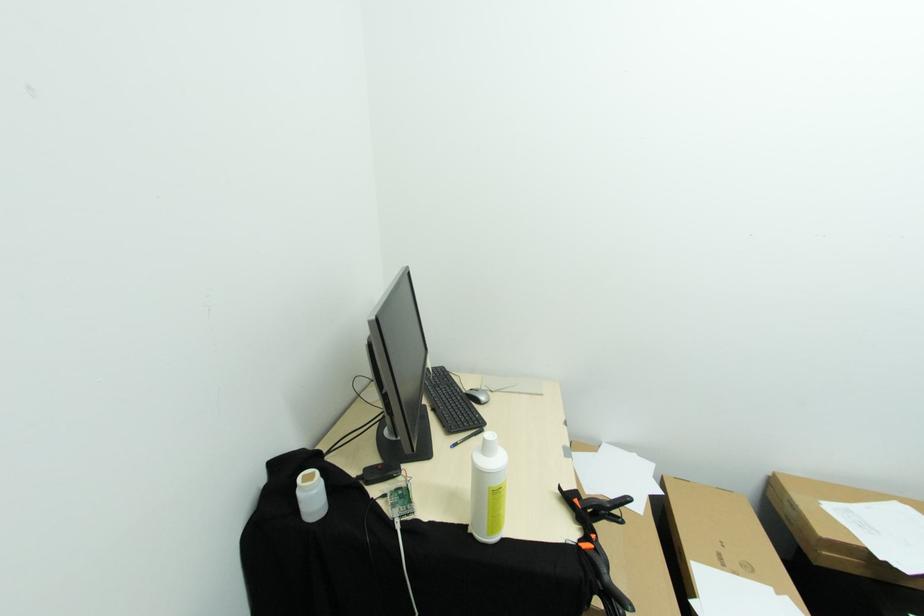
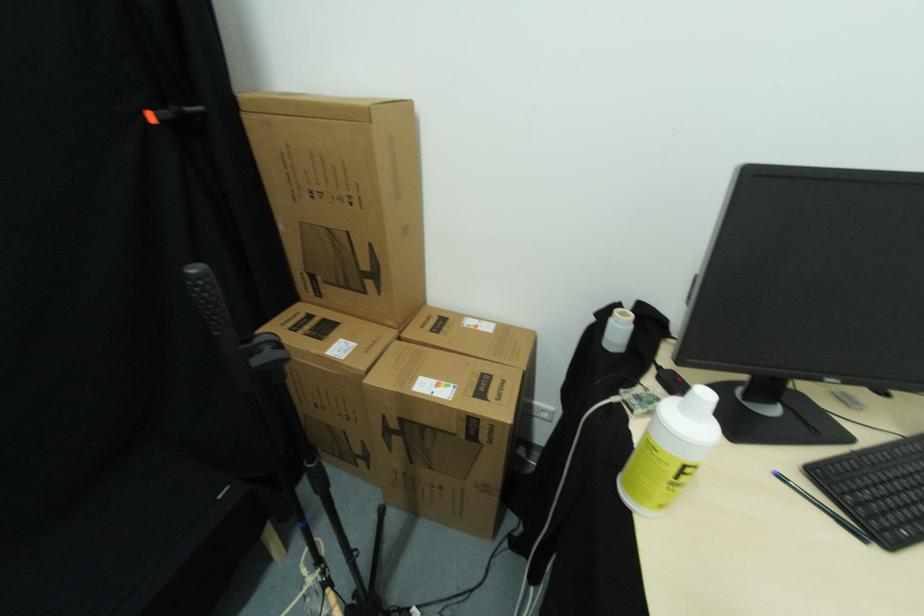
The point at (x=314, y=495) is marked in the first image. Where is the corresponding point in the second image?

(622, 330)